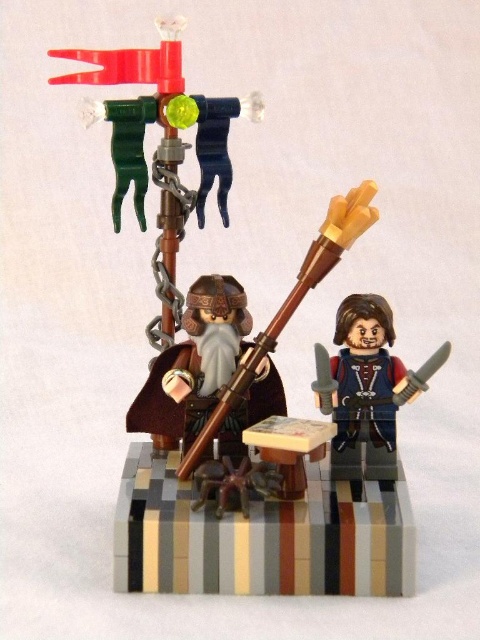
You are a fantasy character in the LEGO diorama and need to grab either the blue fabric vest at center or the wooden spear at center. Which item is easier to reach if you are standing directly in front of both?

The blue fabric vest at center is easier to reach because the wooden spear at center is positioned behind it, making the vest closer to your current position.

You are a game character navigating a fantasy LEGO diorama. You need to locate the blue fabric vest at center. According to the coordinates provided, where exactly is it positioned?

The blue fabric vest at center is positioned at coordinates point (364, 388).